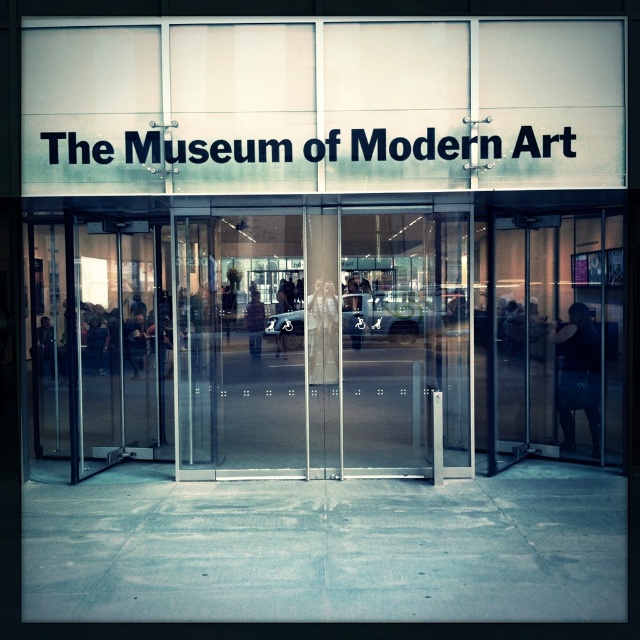
You are standing at the entrance of MoMA and want to enter through the transparent glass doors at center. However, your path is blocked by a dark brown leather jacket at center. Can you move around the jacket to reach the doors?

The transparent glass doors at center is to the left of dark brown leather jacket at center, so you can move around the jacket to the left side to reach the doors.

You are standing at the entrance of The Museum of Modern Art. You see a point marked at coordinates (317, 339). What object is located at this point?

The point at (317, 339) marks the transparent glass doors at center.